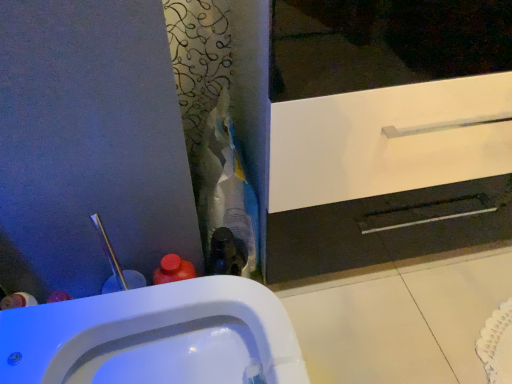
Question: Is white glossy cabinet at center shorter than white glossy sink at lower left?

Choices:
 (A) yes
 (B) no

Answer: (B)

Question: Would you say white glossy cabinet at center is a long distance from white glossy sink at lower left?

Choices:
 (A) yes
 (B) no

Answer: (B)

Question: Is white glossy cabinet at center positioned beyond the bounds of white glossy sink at lower left?

Choices:
 (A) no
 (B) yes

Answer: (B)

Question: From the image's perspective, is white glossy cabinet at center located beneath white glossy sink at lower left?

Choices:
 (A) no
 (B) yes

Answer: (A)

Question: Considering the relative sizes of white glossy cabinet at center and white glossy sink at lower left in the image provided, is white glossy cabinet at center bigger than white glossy sink at lower left?

Choices:
 (A) yes
 (B) no

Answer: (A)

Question: Is white glossy cabinet at center further to camera compared to white glossy sink at lower left?

Choices:
 (A) yes
 (B) no

Answer: (A)

Question: From the image's perspective, is white glossy sink at lower left beneath white glossy cabinet at center?

Choices:
 (A) yes
 (B) no

Answer: (A)

Question: Is white glossy sink at lower left to the right of white glossy cabinet at center from the viewer's perspective?

Choices:
 (A) yes
 (B) no

Answer: (B)

Question: Considering the relative sizes of white glossy sink at lower left and white glossy cabinet at center in the image provided, is white glossy sink at lower left wider than white glossy cabinet at center?

Choices:
 (A) yes
 (B) no

Answer: (A)

Question: From a real-world perspective, does white glossy sink at lower left stand above white glossy cabinet at center?

Choices:
 (A) no
 (B) yes

Answer: (A)

Question: From a real-world perspective, is white glossy sink at lower left positioned under white glossy cabinet at center based on gravity?

Choices:
 (A) yes
 (B) no

Answer: (A)

Question: Is there a large distance between white glossy sink at lower left and white glossy cabinet at center?

Choices:
 (A) yes
 (B) no

Answer: (B)

Question: Considering the positions of point (33, 337) and point (396, 163), is point (33, 337) closer or farther from the camera than point (396, 163)?

Choices:
 (A) closer
 (B) farther

Answer: (A)